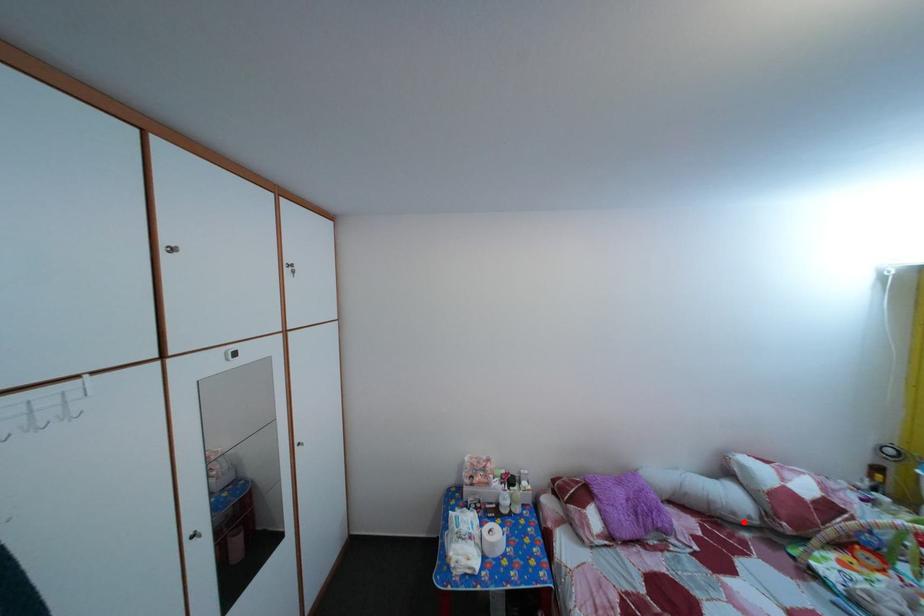
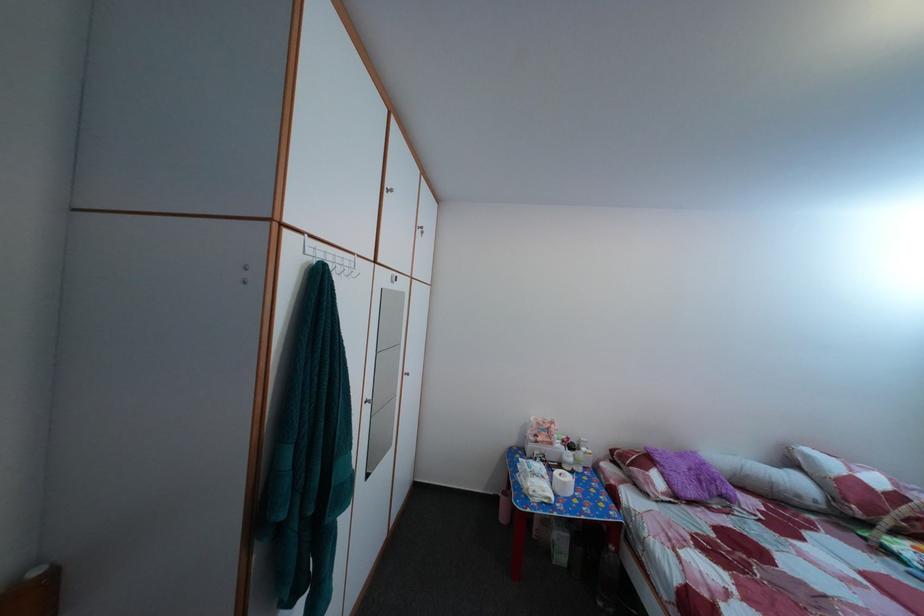
The point at the highlighted location is marked in the first image. Where is the corresponding point in the second image?

(808, 504)